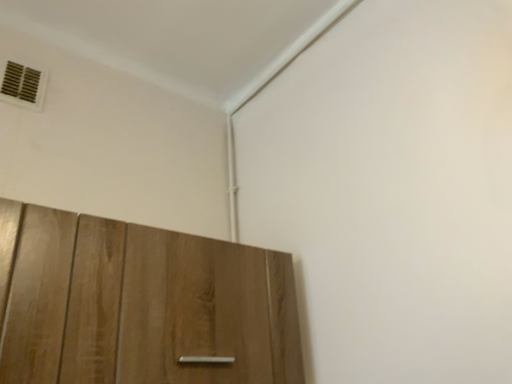
Measure the distance between metallic vent at upper left and camera.

The depth of metallic vent at upper left is 3.96 feet.

What is the approximate height of metallic vent at upper left?

metallic vent at upper left is 18.06 centimeters tall.

This screenshot has height=384, width=512. Identify the location of metallic vent at upper left. (23, 86).

The height and width of the screenshot is (384, 512). What do you see at coordinates (23, 86) in the screenshot?
I see `metallic vent at upper left` at bounding box center [23, 86].

What do you see at coordinates (139, 304) in the screenshot? I see `wooden cabinet at lower left` at bounding box center [139, 304].

Image resolution: width=512 pixels, height=384 pixels. In order to click on wooden cabinet at lower left in this screenshot , I will do `click(139, 304)`.

Identify the location of metallic vent at upper left. This screenshot has height=384, width=512. (23, 86).

Between metallic vent at upper left and wooden cabinet at lower left, which one appears on the right side from the viewer's perspective?

From the viewer's perspective, wooden cabinet at lower left appears more on the right side.

Is metallic vent at upper left positioned before wooden cabinet at lower left?

No, the depth of metallic vent at upper left is greater than that of wooden cabinet at lower left.

Is point (6, 68) positioned before point (151, 364)?

No, (6, 68) is behind (151, 364).

From the image's perspective, is metallic vent at upper left on top of wooden cabinet at lower left?

Yes, from the image's perspective, metallic vent at upper left is over wooden cabinet at lower left.

From a real-world perspective, is metallic vent at upper left on top of wooden cabinet at lower left?

Yes, from a real-world perspective, metallic vent at upper left is on top of wooden cabinet at lower left.

Which of these two, metallic vent at upper left or wooden cabinet at lower left, is wider?

wooden cabinet at lower left.

Who is shorter, metallic vent at upper left or wooden cabinet at lower left?

With less height is metallic vent at upper left.

Considering the sizes of objects metallic vent at upper left and wooden cabinet at lower left in the image provided, who is smaller, metallic vent at upper left or wooden cabinet at lower left?

Smaller between the two is metallic vent at upper left.

Is metallic vent at upper left positioned beyond the bounds of wooden cabinet at lower left?

Absolutely, metallic vent at upper left is external to wooden cabinet at lower left.

Does metallic vent at upper left touch wooden cabinet at lower left?

No, metallic vent at upper left is not with wooden cabinet at lower left.

Is metallic vent at upper left facing away from wooden cabinet at lower left?

No, metallic vent at upper left is not facing the opposite direction of wooden cabinet at lower left.

Can you tell me how much metallic vent at upper left and wooden cabinet at lower left differ in facing direction?

The facing directions of metallic vent at upper left and wooden cabinet at lower left are 1.7 degrees apart.

This screenshot has height=384, width=512. Identify the location of air conditioning on the left of the wooden cabinet at lower left. (23, 86).

Is wooden cabinet at lower left at the right side of metallic vent at upper left?

Yes.

Considering the positions of objects wooden cabinet at lower left and metallic vent at upper left in the image provided, who is behind, wooden cabinet at lower left or metallic vent at upper left?

metallic vent at upper left is further from the camera.

Is point (187, 247) less distant than point (27, 100)?

Yes, it is.

Looking at this image, from the image's perspective, which is below, wooden cabinet at lower left or metallic vent at upper left?

wooden cabinet at lower left.

From a real-world perspective, which is physically below, wooden cabinet at lower left or metallic vent at upper left?

wooden cabinet at lower left, from a real-world perspective.

Which of these two, wooden cabinet at lower left or metallic vent at upper left, is thinner?

metallic vent at upper left is thinner.

Can you confirm if wooden cabinet at lower left is shorter than metallic vent at upper left?

In fact, wooden cabinet at lower left may be taller than metallic vent at upper left.

Considering the sizes of objects wooden cabinet at lower left and metallic vent at upper left in the image provided, who is smaller, wooden cabinet at lower left or metallic vent at upper left?

Smaller between the two is metallic vent at upper left.

From the picture: Can metallic vent at upper left be found inside wooden cabinet at lower left?

No, wooden cabinet at lower left does not contain metallic vent at upper left.

Does wooden cabinet at lower left touch metallic vent at upper left?

wooden cabinet at lower left is not next to metallic vent at upper left, and they're not touching.

Is wooden cabinet at lower left turned away from metallic vent at upper left?

wooden cabinet at lower left is not turned away from metallic vent at upper left.

What's the angular difference between wooden cabinet at lower left and metallic vent at upper left's facing directions?

The angle between the facing direction of wooden cabinet at lower left and the facing direction of metallic vent at upper left is 1.7 degrees.

Measure the distance between wooden cabinet at lower left and metallic vent at upper left.

wooden cabinet at lower left is 29.29 inches away from metallic vent at upper left.

Find the location of `cupboard below the metallic vent at upper left (from the image's perspective)`. cupboard below the metallic vent at upper left (from the image's perspective) is located at coordinates (139, 304).

Find the location of a particular element. air conditioning above the wooden cabinet at lower left (from the image's perspective) is located at coordinates (23, 86).

This screenshot has width=512, height=384. I want to click on air conditioning behind the wooden cabinet at lower left, so click(x=23, y=86).